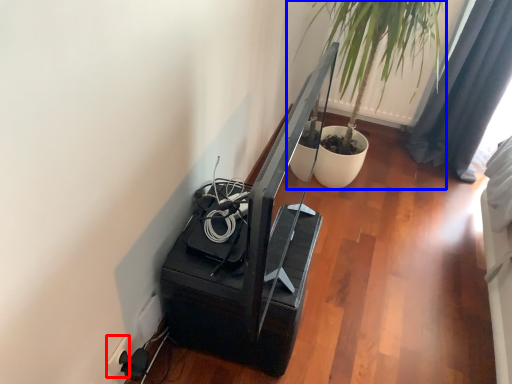
Question: Which point is closer to the camera, electric outlet (highlighted by a red box) or houseplant (highlighted by a blue box)?

Choices:
 (A) electric outlet
 (B) houseplant

Answer: (A)